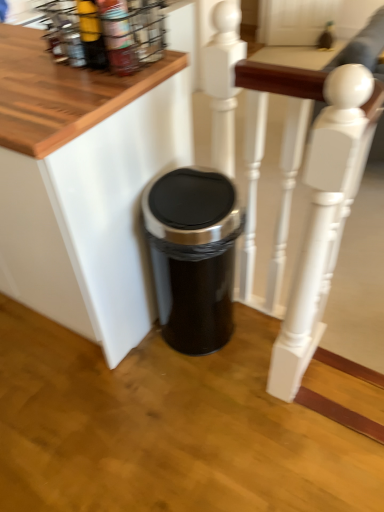
Question: Is black plastic trash can at lower center at the back of matte yellow bottle at upper left?

Choices:
 (A) no
 (B) yes

Answer: (A)

Question: From a real-world perspective, is matte yellow bottle at upper left physically below black plastic trash can at lower center?

Choices:
 (A) no
 (B) yes

Answer: (A)

Question: From a real-world perspective, is matte yellow bottle at upper left located higher than black plastic trash can at lower center?

Choices:
 (A) no
 (B) yes

Answer: (B)

Question: Can you confirm if matte yellow bottle at upper left is positioned to the left of black plastic trash can at lower center?

Choices:
 (A) yes
 (B) no

Answer: (B)

Question: Is matte yellow bottle at upper left closer to the viewer compared to black plastic trash can at lower center?

Choices:
 (A) no
 (B) yes

Answer: (A)

Question: From their relative heights in the image, would you say matte yellow bottle at upper left is taller or shorter than black metallic trash can at center?

Choices:
 (A) tall
 (B) short

Answer: (B)

Question: From the image's perspective, is matte yellow bottle at upper left positioned above or below black metallic trash can at center?

Choices:
 (A) below
 (B) above

Answer: (B)

Question: Would you say matte yellow bottle at upper left is inside or outside black metallic trash can at center?

Choices:
 (A) outside
 (B) inside

Answer: (A)

Question: Is point [97, 35] positioned closer to the camera than point [200, 206]?

Choices:
 (A) farther
 (B) closer

Answer: (B)

Question: In terms of height, does metallic wire spice rack at upper left look taller or shorter compared to matte yellow bottle at upper left?

Choices:
 (A) tall
 (B) short

Answer: (B)

Question: Based on their sizes in the image, would you say metallic wire spice rack at upper left is bigger or smaller than matte yellow bottle at upper left?

Choices:
 (A) big
 (B) small

Answer: (A)

Question: From a real-world perspective, is metallic wire spice rack at upper left positioned above or below matte yellow bottle at upper left?

Choices:
 (A) below
 (B) above

Answer: (A)

Question: From the image's perspective, relative to matte yellow bottle at upper left, is metallic wire spice rack at upper left above or below?

Choices:
 (A) below
 (B) above

Answer: (A)

Question: Is point (155, 51) positioned closer to the camera than point (130, 265)?

Choices:
 (A) closer
 (B) farther

Answer: (A)

Question: Is metallic wire spice rack at upper left taller or shorter than black plastic trash can at lower center?

Choices:
 (A) short
 (B) tall

Answer: (A)